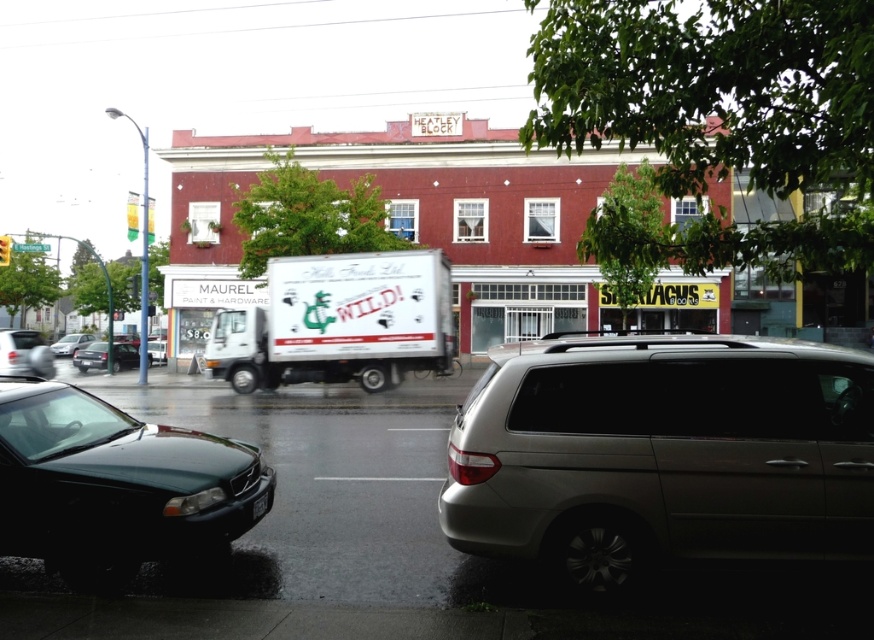
Does shiny black sedan at left have a larger size compared to matte black sedan at left?

No, shiny black sedan at left is not bigger than matte black sedan at left.

Does point (39, 349) lie behind point (82, 362)?

No, it is in front of (82, 362).

Describe the element at coordinates (24, 353) in the screenshot. I see `shiny black sedan at left` at that location.

Locate an element on the screen. This screenshot has height=640, width=874. shiny black sedan at left is located at coordinates (24, 353).

How far apart are silver metallic minivan at lower right and shiny black sedan at left?

They are 23.62 meters apart.

Locate an element on the screen. Image resolution: width=874 pixels, height=640 pixels. silver metallic minivan at lower right is located at coordinates (662, 454).

Find the location of a particular element. The width and height of the screenshot is (874, 640). silver metallic minivan at lower right is located at coordinates (662, 454).

Who is more distant from viewer, (103, 342) or (53, 346)?

The point (53, 346) is more distant.

Measure the distance between point (119, 355) and camera.

Point (119, 355) and camera are 137.67 feet apart from each other.

Does point (130, 368) come closer to viewer compared to point (75, 346)?

That is True.

This screenshot has height=640, width=874. What are the coordinates of `matte black sedan at left` in the screenshot? It's located at (91, 356).